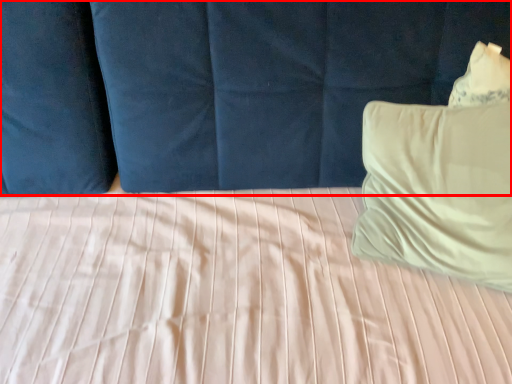
Question: From the image's perspective, where is curtain (annotated by the red box) located in relation to pillow in the image?

Choices:
 (A) below
 (B) above

Answer: (A)